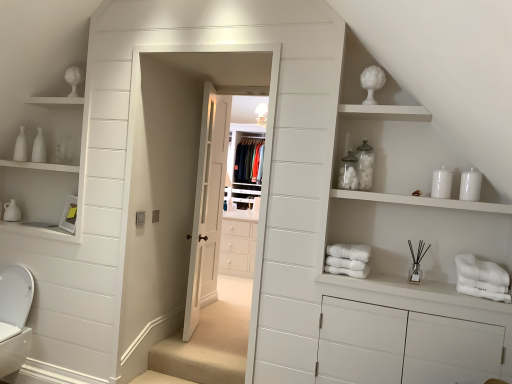
Question: Is white soft bath towel at center, which is counted as the 1th bath towel, starting from the left, to the left or to the right of white cotton bath towel at lower right, the 1th bath towel positioned from the right, in the image?

Choices:
 (A) right
 (B) left

Answer: (B)

Question: In the image, is white soft bath towel at center, which is counted as the 1th bath towel, starting from the left, positioned in front of or behind white cotton bath towel at lower right, which is the 2th bath towel in left-to-right order?

Choices:
 (A) behind
 (B) front

Answer: (A)

Question: Considering the real-world distances, which object is farthest from the white wooden door at center?

Choices:
 (A) white cotton bath towel at lower right, the 1th bath towel positioned from the right
 (B) white matte shelves at upper center
 (C) white glossy toilet bowl at lower left
 (D) white soft bath towel at center, which ranks as the 2th bath towel in right-to-left order

Answer: (A)

Question: Which is farther from the white cotton bath towel at lower right, which is the 2th bath towel in left-to-right order?

Choices:
 (A) white wooden door at center
 (B) white soft bath towel at center, which is counted as the 1th bath towel, starting from the left
 (C) white matte shelves at upper center
 (D) white glossy toilet bowl at lower left

Answer: (D)